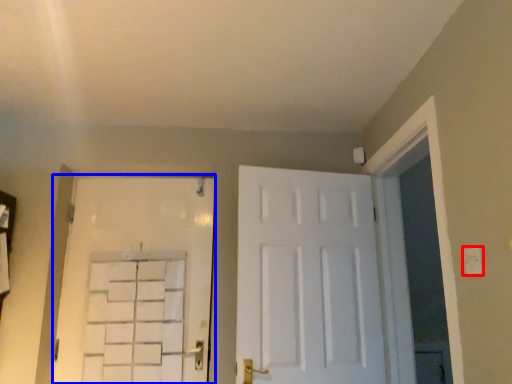
Question: Which object is closer to the camera taking this photo, electric outlet (highlighted by a red box) or door (highlighted by a blue box)?

Choices:
 (A) electric outlet
 (B) door

Answer: (A)